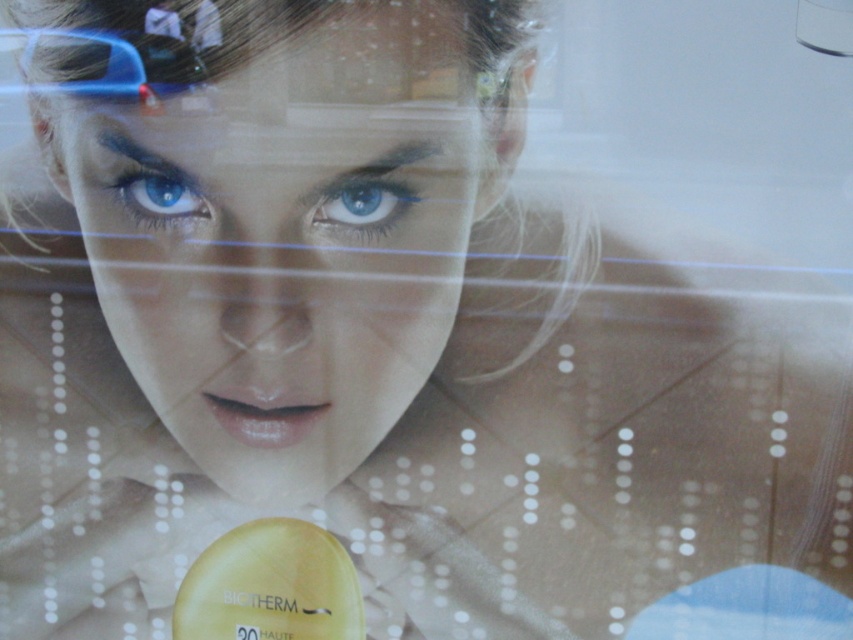
Does blue matte eye at center have a smaller size compared to blue matte eye at upper left?

Correct, blue matte eye at center occupies less space than blue matte eye at upper left.

Between point (328, 193) and point (117, 198), which one is positioned behind?

Point (117, 198)

Find the location of a particular element. The image size is (853, 640). blue matte eye at center is located at coordinates (361, 205).

Does smooth skin face at center appear on the left side of blue matte eye at upper left?

Incorrect, smooth skin face at center is not on the left side of blue matte eye at upper left.

Who is higher up, smooth skin face at center or blue matte eye at upper left?

blue matte eye at upper left is above.

Is point (398, 259) less distant than point (134, 180)?

Yes, point (398, 259) is closer to viewer.

In order to click on smooth skin face at center in this screenshot , I will do `click(288, 243)`.

Between smooth skin face at center and blue matte eye at center, which one appears on the right side from the viewer's perspective?

From the viewer's perspective, blue matte eye at center appears more on the right side.

Does smooth skin face at center appear over blue matte eye at center?

Incorrect, smooth skin face at center is not positioned above blue matte eye at center.

Locate an element on the screen. Image resolution: width=853 pixels, height=640 pixels. smooth skin face at center is located at coordinates (288, 243).